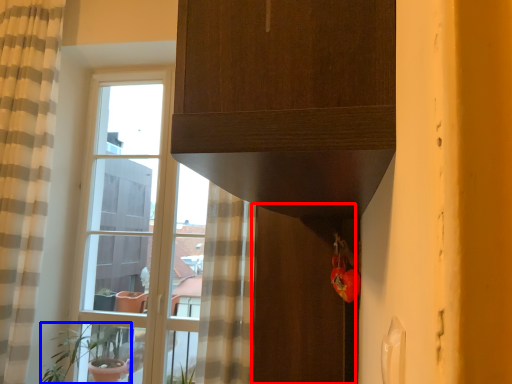
Question: Which object is closer to the camera taking this photo, screen door (highlighted by a red box) or houseplant (highlighted by a blue box)?

Choices:
 (A) screen door
 (B) houseplant

Answer: (A)